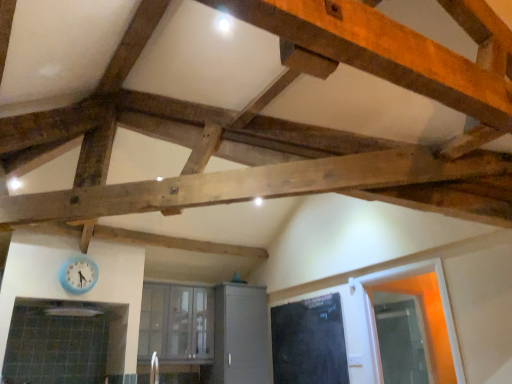
Question: Considering the positions of black matte door at center and clear glass window at center in the image, is black matte door at center taller or shorter than clear glass window at center?

Choices:
 (A) short
 (B) tall

Answer: (A)

Question: Considering the positions of black matte door at center and clear glass window at center in the image, is black matte door at center bigger or smaller than clear glass window at center?

Choices:
 (A) big
 (B) small

Answer: (B)

Question: Considering the real-world distances, which object is closest to the clear glass window at center?

Choices:
 (A) black matte door at center
 (B) matte gray cabinet at center
 (C) blue plastic clock at lower left
 (D) transparent glass door at right

Answer: (B)

Question: Which of these objects is positioned farthest from the black matte door at center?

Choices:
 (A) matte gray cabinet at center
 (B) clear glass window at center
 (C) blue plastic clock at lower left
 (D) transparent glass door at right

Answer: (C)